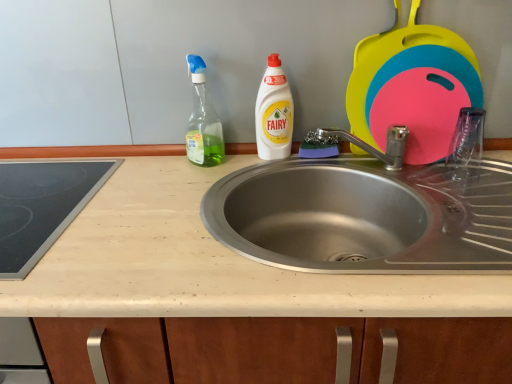
Image resolution: width=512 pixels, height=384 pixels. In order to click on beige laminate countertop at center in this screenshot , I will do `click(210, 264)`.

The image size is (512, 384). In order to click on white plastic bottle at center, acting as the 1th cleaning product starting from the right in this screenshot , I will do `click(274, 113)`.

Is white plastic bottle at center, placed as the second cleaning product when sorted from left to right, oriented away from beige laminate countertop at center?

white plastic bottle at center, placed as the second cleaning product when sorted from left to right, is not turned away from beige laminate countertop at center.

From the picture: In terms of size, does white plastic bottle at center, acting as the 1th cleaning product starting from the right, appear bigger or smaller than beige laminate countertop at center?

Considering their sizes, white plastic bottle at center, acting as the 1th cleaning product starting from the right, takes up less space than beige laminate countertop at center.

From the image's perspective, which is above, white plastic bottle at center, placed as the second cleaning product when sorted from left to right, or beige laminate countertop at center?

white plastic bottle at center, placed as the second cleaning product when sorted from left to right, appears higher in the image.

Which object is further away from the camera, black glass cooktop at left or white plastic bottle at center, acting as the 1th cleaning product starting from the right?

white plastic bottle at center, acting as the 1th cleaning product starting from the right, is more distant.

Is black glass cooktop at left to the right of white plastic bottle at center, placed as the second cleaning product when sorted from left to right, from the viewer's perspective?

In fact, black glass cooktop at left is to the left of white plastic bottle at center, placed as the second cleaning product when sorted from left to right.

Which is farther, (27,181) or (267,125)?

Positioned behind is point (267,125).

Looking at this image, is beige laminate countertop at center taller or shorter than green glass spray bottle at upper left, placed as the 1th cleaning product when sorted from left to right?

beige laminate countertop at center is taller than green glass spray bottle at upper left, placed as the 1th cleaning product when sorted from left to right.

Is beige laminate countertop at center oriented towards green glass spray bottle at upper left, placed as the 1th cleaning product when sorted from left to right?

No, beige laminate countertop at center is not turned towards green glass spray bottle at upper left, placed as the 1th cleaning product when sorted from left to right.

Between green glass spray bottle at upper left, which is the 2th cleaning product in right-to-left order, and black glass cooktop at left, which one appears on the right side from the viewer's perspective?

Positioned to the right is green glass spray bottle at upper left, which is the 2th cleaning product in right-to-left order.

From a real-world perspective, is green glass spray bottle at upper left, which is the 2th cleaning product in right-to-left order, beneath black glass cooktop at left?

No, from a real-world perspective, green glass spray bottle at upper left, which is the 2th cleaning product in right-to-left order, is not below black glass cooktop at left.

Between green glass spray bottle at upper left, which is the 2th cleaning product in right-to-left order, and black glass cooktop at left, which one has larger width?

black glass cooktop at left.

Can you confirm if black glass cooktop at left is wider than beige laminate countertop at center?

In fact, black glass cooktop at left might be narrower than beige laminate countertop at center.

Which of these two, black glass cooktop at left or beige laminate countertop at center, stands taller?

beige laminate countertop at center.

From the image's perspective, relative to beige laminate countertop at center, is black glass cooktop at left above or below?

Based on their image positions, black glass cooktop at left is located above beige laminate countertop at center.

Which is in front, green glass spray bottle at upper left, placed as the 1th cleaning product when sorted from left to right, or beige laminate countertop at center?

beige laminate countertop at center is in front.

Is green glass spray bottle at upper left, placed as the 1th cleaning product when sorted from left to right, wider than beige laminate countertop at center?

No.

Does green glass spray bottle at upper left, which is the 2th cleaning product in right-to-left order, appear on the left side of beige laminate countertop at center?

Indeed, green glass spray bottle at upper left, which is the 2th cleaning product in right-to-left order, is positioned on the left side of beige laminate countertop at center.

Could you tell me if green glass spray bottle at upper left, which is the 2th cleaning product in right-to-left order, is turned towards white plastic bottle at center, placed as the second cleaning product when sorted from left to right?

No, green glass spray bottle at upper left, which is the 2th cleaning product in right-to-left order, is not oriented towards white plastic bottle at center, placed as the second cleaning product when sorted from left to right.

In terms of height, does green glass spray bottle at upper left, which is the 2th cleaning product in right-to-left order, look taller or shorter compared to white plastic bottle at center, placed as the second cleaning product when sorted from left to right?

green glass spray bottle at upper left, which is the 2th cleaning product in right-to-left order, is taller than white plastic bottle at center, placed as the second cleaning product when sorted from left to right.

Can you tell me how much green glass spray bottle at upper left, which is the 2th cleaning product in right-to-left order, and white plastic bottle at center, placed as the second cleaning product when sorted from left to right, differ in facing direction?

51.1 degrees.

Does green glass spray bottle at upper left, placed as the 1th cleaning product when sorted from left to right, have a lesser width compared to white plastic bottle at center, acting as the 1th cleaning product starting from the right?

In fact, green glass spray bottle at upper left, placed as the 1th cleaning product when sorted from left to right, might be wider than white plastic bottle at center, acting as the 1th cleaning product starting from the right.

Identify the location of countertop below the white plastic bottle at center, placed as the second cleaning product when sorted from left to right (from the image's perspective). This screenshot has height=384, width=512. point(210,264).

Identify the location of gas stove to the left of white plastic bottle at center, placed as the second cleaning product when sorted from left to right. The width and height of the screenshot is (512, 384). (42, 207).

Looking at the image, which one is located further to white plastic bottle at center, placed as the second cleaning product when sorted from left to right, beige laminate countertop at center or black glass cooktop at left?

black glass cooktop at left is further to white plastic bottle at center, placed as the second cleaning product when sorted from left to right.

Looking at the image, which one is located closer to white plastic bottle at center, acting as the 1th cleaning product starting from the right, black glass cooktop at left or green glass spray bottle at upper left, which is the 2th cleaning product in right-to-left order?

green glass spray bottle at upper left, which is the 2th cleaning product in right-to-left order, is closer to white plastic bottle at center, acting as the 1th cleaning product starting from the right.

Based on their spatial positions, is black glass cooktop at left or white plastic bottle at center, placed as the second cleaning product when sorted from left to right, closer to green glass spray bottle at upper left, which is the 2th cleaning product in right-to-left order?

white plastic bottle at center, placed as the second cleaning product when sorted from left to right, is positioned closer to the anchor green glass spray bottle at upper left, which is the 2th cleaning product in right-to-left order.

When comparing their distances from black glass cooktop at left, does beige laminate countertop at center or white plastic bottle at center, acting as the 1th cleaning product starting from the right, seem further?

white plastic bottle at center, acting as the 1th cleaning product starting from the right.

Estimate the real-world distances between objects in this image. Which object is closer to beige laminate countertop at center, green glass spray bottle at upper left, which is the 2th cleaning product in right-to-left order, or white plastic bottle at center, acting as the 1th cleaning product starting from the right?

green glass spray bottle at upper left, which is the 2th cleaning product in right-to-left order, lies closer to beige laminate countertop at center than the other object.

Considering their positions, is white plastic bottle at center, placed as the second cleaning product when sorted from left to right, positioned further to beige laminate countertop at center than green glass spray bottle at upper left, placed as the 1th cleaning product when sorted from left to right?

Among the two, white plastic bottle at center, placed as the second cleaning product when sorted from left to right, is located further to beige laminate countertop at center.

Considering their positions, is black glass cooktop at left positioned further to beige laminate countertop at center than white plastic bottle at center, placed as the second cleaning product when sorted from left to right?

white plastic bottle at center, placed as the second cleaning product when sorted from left to right, lies further to beige laminate countertop at center than the other object.

Considering their positions, is beige laminate countertop at center positioned further to green glass spray bottle at upper left, which is the 2th cleaning product in right-to-left order, than black glass cooktop at left?

black glass cooktop at left is positioned further to the anchor green glass spray bottle at upper left, which is the 2th cleaning product in right-to-left order.

Where is `countertop located between black glass cooktop at left and white plastic bottle at center, acting as the 1th cleaning product starting from the right, in the left-right direction`? Image resolution: width=512 pixels, height=384 pixels. countertop located between black glass cooktop at left and white plastic bottle at center, acting as the 1th cleaning product starting from the right, in the left-right direction is located at coordinates (210, 264).

You are a GUI agent. You are given a task and a screenshot of the screen. Output one action in this format:
    pyautogui.click(x=<x>, y=<y>)
    Task: Click on the cleaning product between black glass cooktop at left and white plastic bottle at center, acting as the 1th cleaning product starting from the right, in the horizontal direction
    Image resolution: width=512 pixels, height=384 pixels.
    Given the screenshot: What is the action you would take?
    pyautogui.click(x=202, y=121)

This screenshot has height=384, width=512. I want to click on cleaning product between green glass spray bottle at upper left, which is the 2th cleaning product in right-to-left order, and beige laminate countertop at center, in the vertical direction, so click(274, 113).

The image size is (512, 384). In order to click on gas stove between green glass spray bottle at upper left, which is the 2th cleaning product in right-to-left order, and beige laminate countertop at center vertically in this screenshot , I will do click(42, 207).